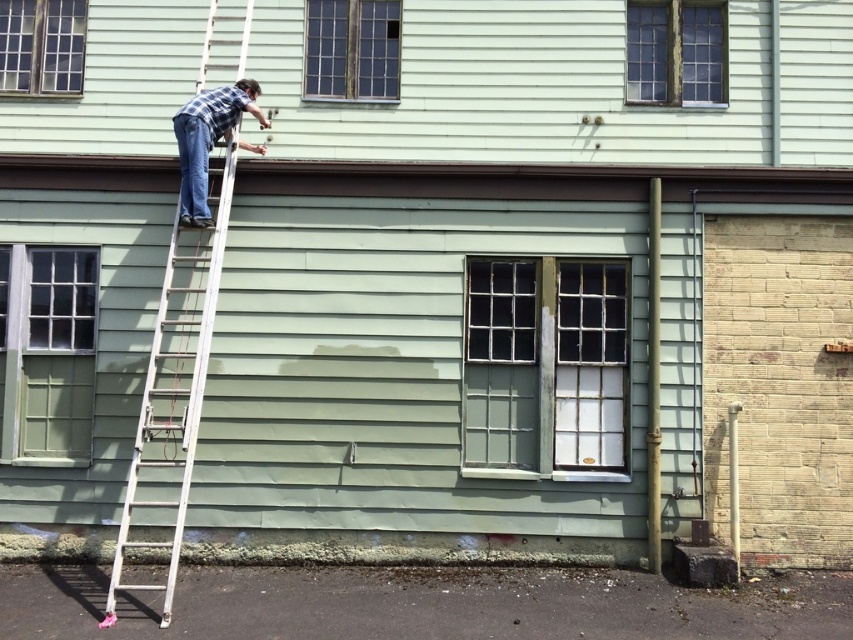
You are a contractor assessing the building exterior. You need to determine where to place a new sensor that must be installed on the building wall but cannot be placed within 1 meter of any windows. Given that the clear glass window at upper center is located at point (675, 52), is the point 0.1, 0.8 a safe location for the sensor?

The clear glass window at upper center is located at point (675, 52). The distance between point 0.1, 0.8 and the window is less than 1 meter, so placing the sensor there would violate the requirement. Choose a different location farther away.

You are a painter standing on the ground looking up at the building. Which window, the matte green window at lower left or the wooden grid window at upper center, is easier to reach with your paintbrush?

The matte green window at lower left is closer to the viewer than the wooden grid window at upper center, so it is easier to reach with your paintbrush.